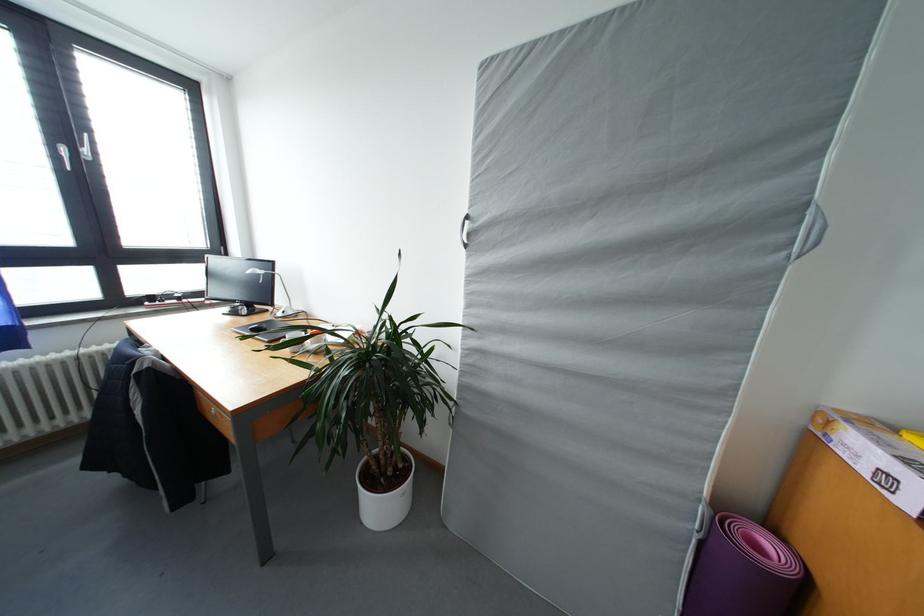
Which object does [854,517] point to?

It refers to a cardboard box.